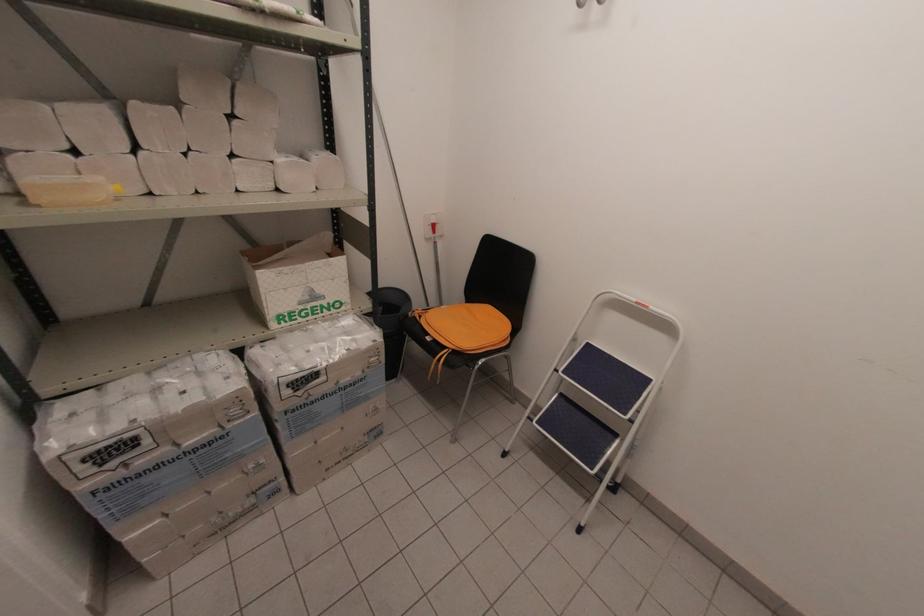
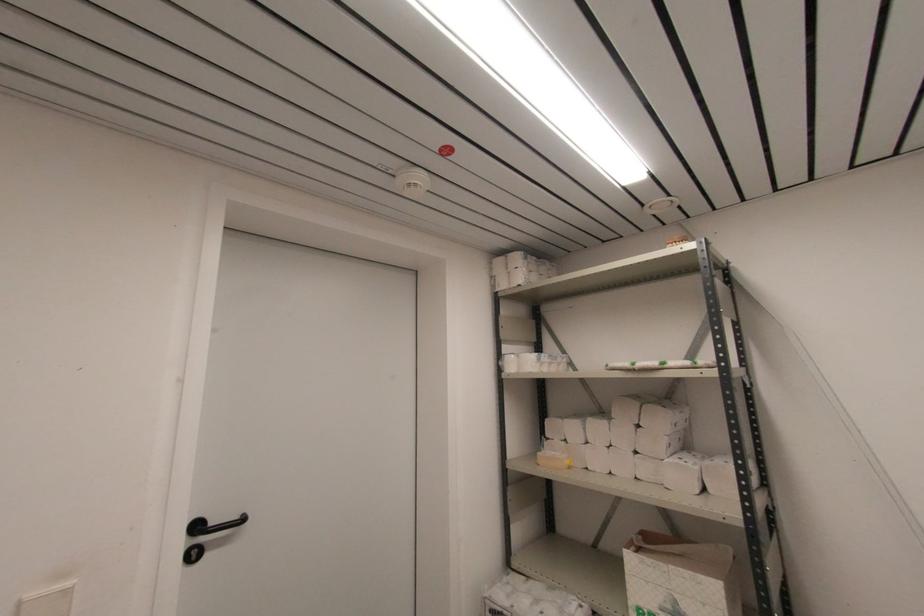
The point at (234, 156) is marked in the first image. Where is the corresponding point in the second image?

(637, 453)